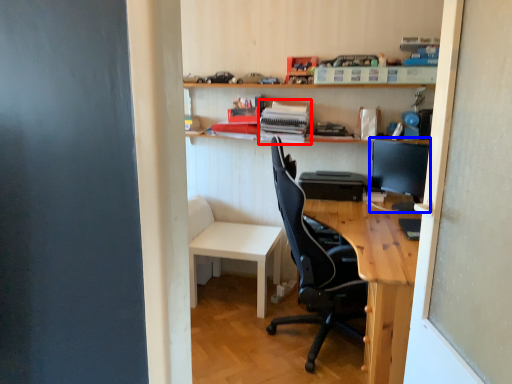
Question: Which object appears closest to the camera in this image, book (highlighted by a red box) or computer monitor (highlighted by a blue box)?

Choices:
 (A) book
 (B) computer monitor

Answer: (B)